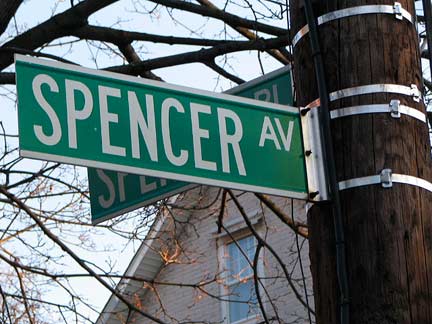
At what (x,y) coordinates should I click in order to perform the action: click on window sill. Please return your answer as a coordinate pair (x, y). This screenshot has width=432, height=324. Looking at the image, I should click on [245, 317].